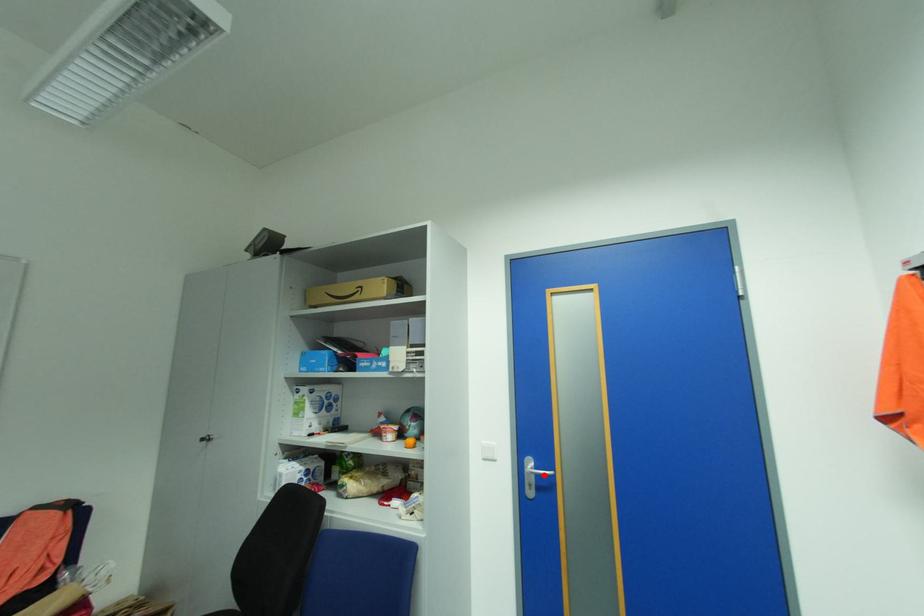
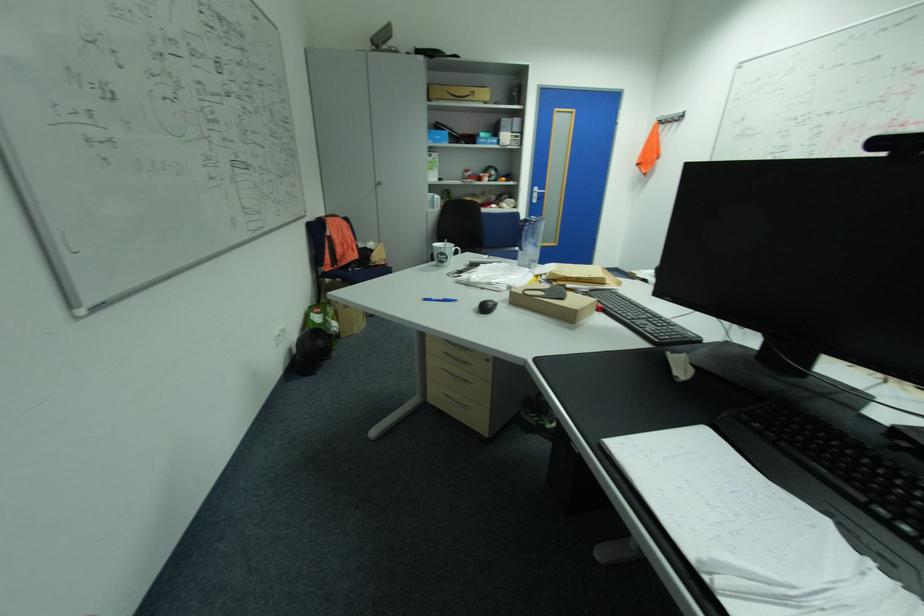
Find the pixel in the second image that matches the highlighted location in the first image.

(544, 193)